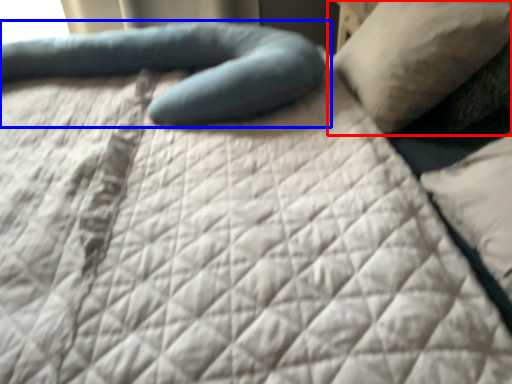
Question: Which object appears farthest to the camera in this image, pillow (highlighted by a red box) or pillow (highlighted by a blue box)?

Choices:
 (A) pillow
 (B) pillow

Answer: (B)